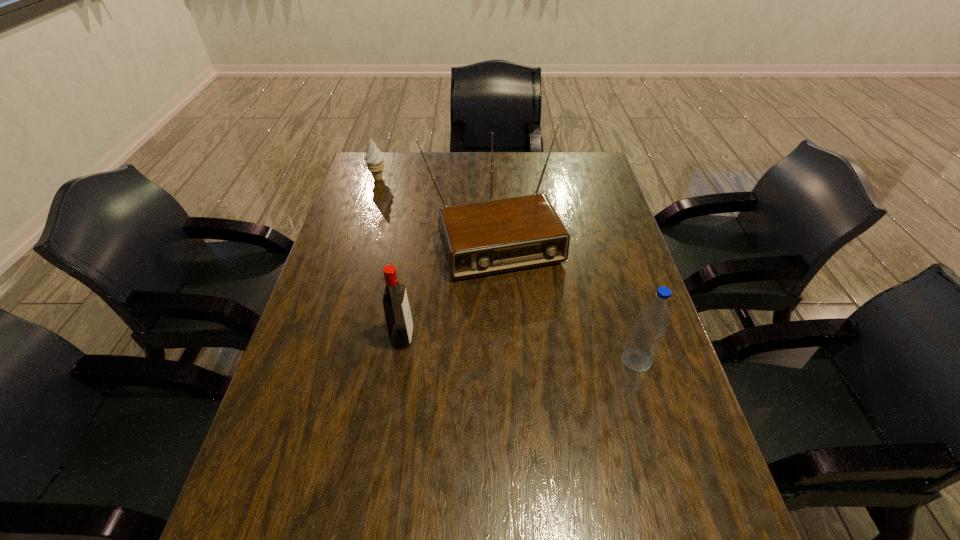
In order to click on vacant space located 0.130m on the front-facing side of the farthest object in this screenshot , I will do `click(396, 201)`.

Where is `free space located on the front panel of the third nearest object`? This screenshot has height=540, width=960. free space located on the front panel of the third nearest object is located at coordinates (529, 322).

The image size is (960, 540). What are the coordinates of `free space located 0.160m on the front panel of the third nearest object` in the screenshot? It's located at (530, 325).

Identify the location of free space located on the front panel of the third nearest object. (541, 354).

I want to click on object located in the far edge section of the desktop, so tap(374, 158).

In order to click on object that is at the left edge in this screenshot , I will do `click(374, 158)`.

Where is `object present at the right edge`? The width and height of the screenshot is (960, 540). object present at the right edge is located at coordinates (644, 340).

Identify the location of object present at the far left corner. (374, 158).

This screenshot has width=960, height=540. In order to click on vacant space at the far edge in this screenshot , I will do `click(514, 173)`.

You are a GUI agent. You are given a task and a screenshot of the screen. Output one action in this format:
    pyautogui.click(x=<x>, y=<y>)
    Task: Click on the vacant space at the near edge of the desktop
    The height and width of the screenshot is (540, 960).
    Given the screenshot: What is the action you would take?
    pyautogui.click(x=477, y=502)